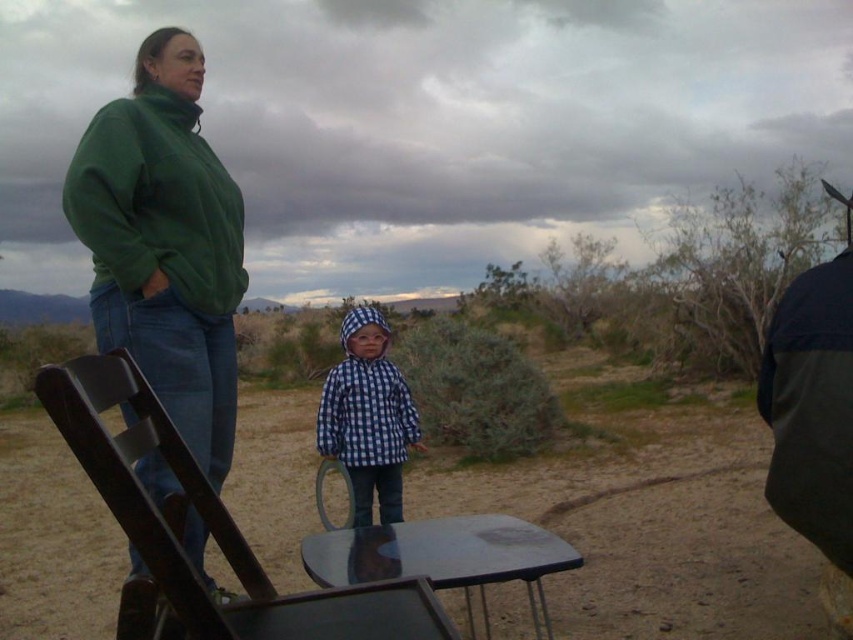
Does dirt field at center have a larger size compared to wooden folding chair at center?

Correct, dirt field at center is larger in size than wooden folding chair at center.

The width and height of the screenshot is (853, 640). Identify the location of dirt field at center. (647, 513).

Identify the location of dirt field at center. (647, 513).

Is green fleece sweatshirt at upper left taller than blue checkered jacket at center?

No.

Does point (195, 288) lie in front of point (357, 506)?

Yes, point (195, 288) is closer to viewer.

Does point (193, 166) come in front of point (392, 513)?

Yes.

You are a GUI agent. You are given a task and a screenshot of the screen. Output one action in this format:
    pyautogui.click(x=<x>, y=<y>)
    Task: Click on the green fleece sweatshirt at upper left
    This screenshot has width=853, height=640.
    Given the screenshot: What is the action you would take?
    pyautogui.click(x=155, y=204)

This screenshot has width=853, height=640. What do you see at coordinates (647, 513) in the screenshot?
I see `dirt field at center` at bounding box center [647, 513].

Between dirt field at center and dark green jacket at right, which one has less height?

Standing shorter between the two is dark green jacket at right.

Does point (602, 460) come farther from viewer compared to point (772, 422)?

Yes.

I want to click on dirt field at center, so click(647, 513).